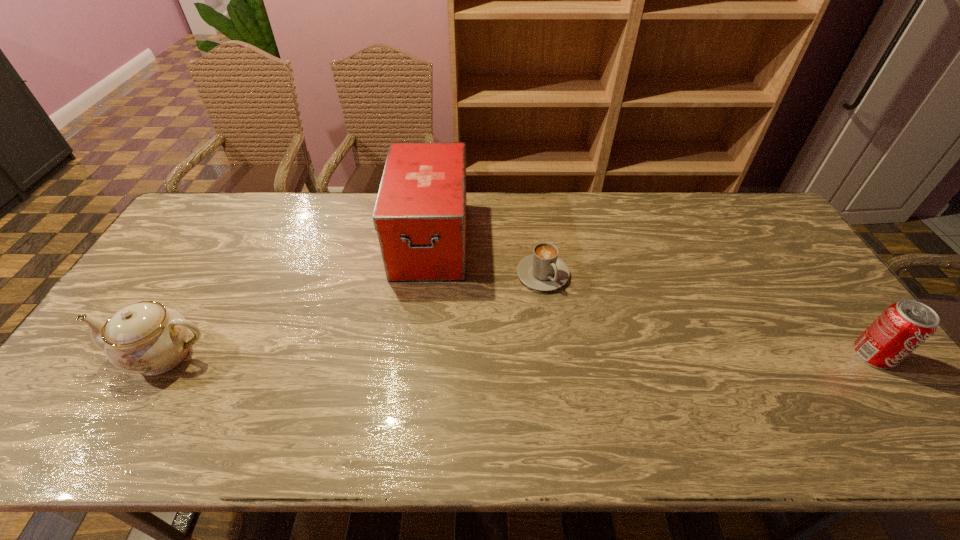
Where is `vacant space at the far left corner of the desktop`? This screenshot has height=540, width=960. vacant space at the far left corner of the desktop is located at coordinates (191, 215).

Identify the location of vacant space at the near left corner of the desktop. The image size is (960, 540). pos(67,402).

In the image, there is a desktop. Where is `free space at the near right corner`? The height and width of the screenshot is (540, 960). free space at the near right corner is located at coordinates (878, 394).

Find the location of a particular element. The height and width of the screenshot is (540, 960). free spot between the second object from left to right and the cappuccino is located at coordinates pos(487,257).

This screenshot has height=540, width=960. I want to click on free space between the tallest object and the rightmost object, so (x=652, y=298).

Identify the location of free space between the leftmost object and the cappuccino. This screenshot has width=960, height=540. (354, 315).

Locate an element on the screen. The width and height of the screenshot is (960, 540). vacant space in between the soda can and the second object from left to right is located at coordinates (652, 298).

Identify the location of free space between the rightmost object and the third object from right to left. (652, 298).

The height and width of the screenshot is (540, 960). In order to click on vacant area that lies between the soda can and the cappuccino in this screenshot , I will do `click(708, 315)`.

Locate an element on the screen. The width and height of the screenshot is (960, 540). unoccupied position between the shortest object and the soda can is located at coordinates (708, 315).